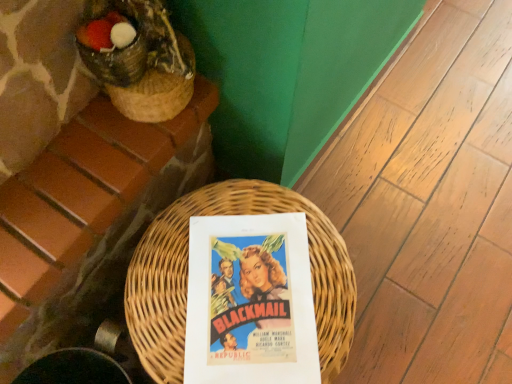
Question: Would you say matte paper poster at center is inside or outside woven wicker basket at center?

Choices:
 (A) inside
 (B) outside

Answer: (A)

Question: Considering the positions of matte paper poster at center and woven wicker basket at center in the image, is matte paper poster at center taller or shorter than woven wicker basket at center?

Choices:
 (A) short
 (B) tall

Answer: (A)

Question: From the image's perspective, is matte paper poster at center above or below woven wicker basket at center?

Choices:
 (A) below
 (B) above

Answer: (B)

Question: Is woven wicker basket at center in front of or behind matte paper poster at center in the image?

Choices:
 (A) behind
 (B) front

Answer: (B)

Question: Is woven wicker basket at center wider or thinner than matte paper poster at center?

Choices:
 (A) thin
 (B) wide

Answer: (B)

Question: Based on their positions, is woven wicker basket at center located to the left or right of matte paper poster at center?

Choices:
 (A) left
 (B) right

Answer: (A)

Question: Choose the correct answer: Is woven wicker basket at center inside matte paper poster at center or outside it?

Choices:
 (A) inside
 (B) outside

Answer: (B)